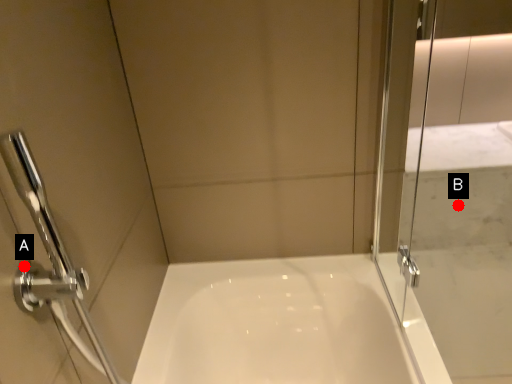
Question: Two points are circled on the image, labeled by A and B beside each circle. Among these points, which one is farthest from the camera?

Choices:
 (A) A is further
 (B) B is further

Answer: (B)